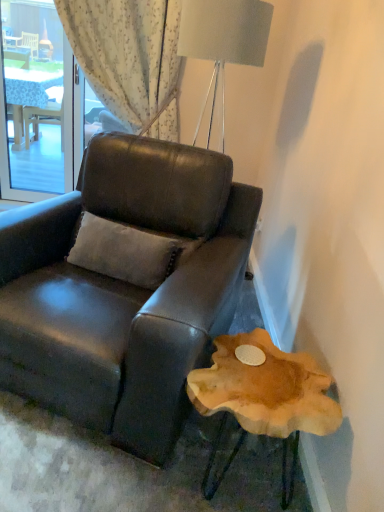
Question: Does transparent glass window at upper left have a lesser width compared to matte black leather chair at center?

Choices:
 (A) no
 (B) yes

Answer: (B)

Question: Considering the relative sizes of transparent glass window at upper left and matte black leather chair at center in the image provided, is transparent glass window at upper left smaller than matte black leather chair at center?

Choices:
 (A) no
 (B) yes

Answer: (B)

Question: Considering the relative positions of transparent glass window at upper left and matte black leather chair at center in the image provided, is transparent glass window at upper left behind matte black leather chair at center?

Choices:
 (A) yes
 (B) no

Answer: (A)

Question: From the image's perspective, is transparent glass window at upper left below matte black leather chair at center?

Choices:
 (A) no
 (B) yes

Answer: (A)

Question: Does transparent glass window at upper left have a larger size compared to matte black leather chair at center?

Choices:
 (A) no
 (B) yes

Answer: (A)

Question: Is matte black leather chair at center taller or shorter than transparent glass window at upper left?

Choices:
 (A) short
 (B) tall

Answer: (A)

Question: Is matte black leather chair at center spatially inside transparent glass window at upper left, or outside of it?

Choices:
 (A) outside
 (B) inside

Answer: (A)

Question: Relative to transparent glass window at upper left, is matte black leather chair at center in front or behind?

Choices:
 (A) behind
 (B) front

Answer: (B)

Question: Is point (49, 407) closer or farther from the camera than point (13, 89)?

Choices:
 (A) farther
 (B) closer

Answer: (B)

Question: From their relative heights in the image, would you say natural wood side table at lower right is taller or shorter than transparent glass window at upper left?

Choices:
 (A) short
 (B) tall

Answer: (A)

Question: In terms of size, does natural wood side table at lower right appear bigger or smaller than transparent glass window at upper left?

Choices:
 (A) small
 (B) big

Answer: (B)

Question: In terms of width, does natural wood side table at lower right look wider or thinner when compared to transparent glass window at upper left?

Choices:
 (A) wide
 (B) thin

Answer: (A)

Question: From a real-world perspective, relative to transparent glass window at upper left, is natural wood side table at lower right vertically above or below?

Choices:
 (A) above
 (B) below

Answer: (B)

Question: Considering the positions of suede-like beige pillow at center and transparent glass window at upper left in the image, is suede-like beige pillow at center wider or thinner than transparent glass window at upper left?

Choices:
 (A) wide
 (B) thin

Answer: (A)

Question: In the image, is suede-like beige pillow at center positioned in front of or behind transparent glass window at upper left?

Choices:
 (A) front
 (B) behind

Answer: (A)